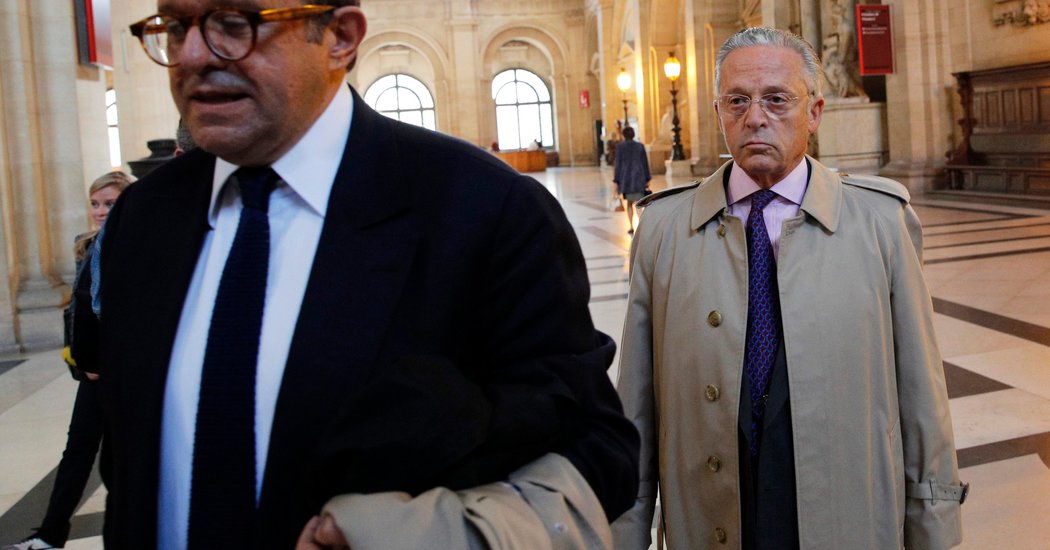
Find the location of a particular element. The width and height of the screenshot is (1050, 550). bench is located at coordinates (1013, 160).